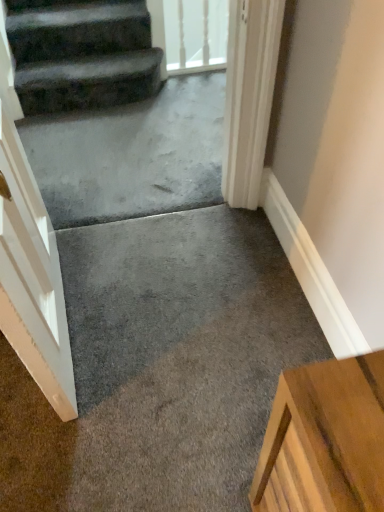
Question: Considering the relative sizes of dark gray carpeted stairs at upper left and transparent glass door at upper center in the image provided, is dark gray carpeted stairs at upper left wider than transparent glass door at upper center?

Choices:
 (A) yes
 (B) no

Answer: (A)

Question: Is dark gray carpeted stairs at upper left shorter than transparent glass door at upper center?

Choices:
 (A) yes
 (B) no

Answer: (A)

Question: From the image's perspective, is dark gray carpeted stairs at upper left located above transparent glass door at upper center?

Choices:
 (A) yes
 (B) no

Answer: (B)

Question: Is dark gray carpeted stairs at upper left located outside transparent glass door at upper center?

Choices:
 (A) no
 (B) yes

Answer: (B)

Question: Considering the relative positions of dark gray carpeted stairs at upper left and transparent glass door at upper center in the image provided, is dark gray carpeted stairs at upper left to the right of transparent glass door at upper center from the viewer's perspective?

Choices:
 (A) no
 (B) yes

Answer: (A)

Question: Considering the relative sizes of dark gray carpeted stairs at upper left and transparent glass door at upper center in the image provided, is dark gray carpeted stairs at upper left taller than transparent glass door at upper center?

Choices:
 (A) no
 (B) yes

Answer: (A)

Question: Could you tell me if dark gray carpeted stairs at upper left is facing gray concrete at center?

Choices:
 (A) yes
 (B) no

Answer: (A)

Question: Is there a large distance between dark gray carpeted stairs at upper left and gray concrete at center?

Choices:
 (A) no
 (B) yes

Answer: (A)

Question: Is dark gray carpeted stairs at upper left in front of gray concrete at center?

Choices:
 (A) no
 (B) yes

Answer: (A)

Question: Could gray concrete at center be considered to be inside dark gray carpeted stairs at upper left?

Choices:
 (A) yes
 (B) no

Answer: (B)

Question: Considering the relative sizes of dark gray carpeted stairs at upper left and gray concrete at center in the image provided, is dark gray carpeted stairs at upper left wider than gray concrete at center?

Choices:
 (A) yes
 (B) no

Answer: (B)

Question: Is dark gray carpeted stairs at upper left to the left of gray concrete at center from the viewer's perspective?

Choices:
 (A) yes
 (B) no

Answer: (A)

Question: Does gray concrete at center have a greater width compared to transparent glass door at upper center?

Choices:
 (A) yes
 (B) no

Answer: (A)